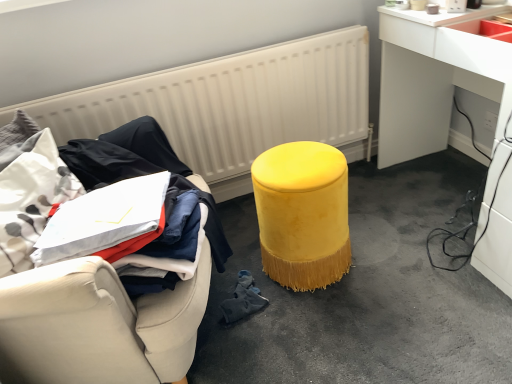
You are a GUI agent. You are given a task and a screenshot of the screen. Output one action in this format:
    pyautogui.click(x=<x>, y=<y>)
    Task: Click on the velvet yellow stool at center
    The width and height of the screenshot is (512, 384).
    Given the screenshot: What is the action you would take?
    pyautogui.click(x=303, y=214)

This screenshot has height=384, width=512. I want to click on velvet yellow stool at center, so click(366, 295).

I want to click on velvet yellow stool at center, so (x=82, y=300).

Which is behind, point (225, 122) or point (152, 139)?

The point (225, 122) is farther.

From a real-world perspective, is white textured radiator at upper center on top of black fabric at left?

No, from a real-world perspective, white textured radiator at upper center is not over black fabric at left

Is white textured radiator at upper center wider than black fabric at left?

No.

From the image's perspective, is white textured radiator at upper center above or below black fabric at left?

Clearly, from the image's perspective, white textured radiator at upper center is above black fabric at left.

From a real-world perspective, is white glossy desk at right above or below velvet yellow stool at center?

white glossy desk at right is situated higher than velvet yellow stool at center in the real world.

How many degrees apart are the facing directions of white glossy desk at right and velvet yellow stool at center?

They differ by 89.2 degrees in their facing directions.

Is velvet yellow stool at center surrounded by white glossy desk at right?

No, velvet yellow stool at center is not surrounded by white glossy desk at right.

Which object is wider, white glossy desk at right or velvet yellow stool at center?

white glossy desk at right.

Choose the correct answer: Is white textured radiator at upper center inside velvet yellow stool at center or outside it?

white textured radiator at upper center is outside velvet yellow stool at center.

Is white textured radiator at upper center facing towards velvet yellow stool at center?

Yes, white textured radiator at upper center is facing velvet yellow stool at center.

Looking at the image, does white textured radiator at upper center seem bigger or smaller compared to velvet yellow stool at center?

In the image, white textured radiator at upper center appears to be larger than velvet yellow stool at center.

How different are the orientations of white textured radiator at upper center and velvet yellow stool at center in degrees?

The facing directions of white textured radiator at upper center and velvet yellow stool at center are 1.83 degrees apart.

Is white textured radiator at upper center to the left or to the right of white glossy desk at right in the image?

Clearly, white textured radiator at upper center is on the left of white glossy desk at right in the image.

How different are the orientations of white textured radiator at upper center and white glossy desk at right in degrees?

white textured radiator at upper center and white glossy desk at right are facing 91.1 degrees away from each other.

In the scene shown: Is white textured radiator at upper center positioned in front of white glossy desk at right?

No, white textured radiator at upper center is further to the viewer.

You are a GUI agent. You are given a task and a screenshot of the screen. Output one action in this format:
    pyautogui.click(x=<x>, y=<y>)
    Task: Click on the radiator located on the left of white glossy desk at right
    
    Given the screenshot: What is the action you would take?
    pyautogui.click(x=230, y=102)

From the image's perspective, would you say white textured radiator at upper center is positioned over velvet yellow stool at center?

Indeed, from the image's perspective, white textured radiator at upper center is shown above velvet yellow stool at center.

Can you confirm if white textured radiator at upper center is wider than velvet yellow stool at center?

No.

You are a GUI agent. You are given a task and a screenshot of the screen. Output one action in this format:
    pyautogui.click(x=<x>, y=<y>)
    Task: Click on the radiator above the velvet yellow stool at center (from a real-world perspective)
    
    Given the screenshot: What is the action you would take?
    pyautogui.click(x=230, y=102)

Which object is closer to the camera, white textured radiator at upper center or velvet yellow stool at center?

velvet yellow stool at center.

Is there a large distance between black fabric at left and white textured radiator at upper center?

They are positioned close to each other.

Is black fabric at left behind white textured radiator at upper center?

No, black fabric at left is in front of white textured radiator at upper center.

In order to click on clothing below the white textured radiator at upper center (from the image's perspective) in this screenshot , I will do `click(147, 144)`.

Which of these two, black fabric at left or white textured radiator at upper center, is wider?

Wider between the two is black fabric at left.

Who is more distant, velvet yellow stool at center or velvet yellow stool at center?

velvet yellow stool at center is behind.

From the image's perspective, which object appears higher, velvet yellow stool at center or velvet yellow stool at center?

velvet yellow stool at center appears higher in the image.

Is velvet yellow stool at center placed right next to velvet yellow stool at center?

No, velvet yellow stool at center is not in contact with velvet yellow stool at center.

Consider the image. Does velvet yellow stool at center have a larger size compared to velvet yellow stool at center?

No, velvet yellow stool at center is not bigger than velvet yellow stool at center.

The image size is (512, 384). What are the coordinates of `radiator lying above the black fabric at left (from the image's perspective)` in the screenshot? It's located at (230, 102).

Where is `stool on the left of white glossy desk at right`? This screenshot has height=384, width=512. stool on the left of white glossy desk at right is located at coordinates (303, 214).

Which object lies nearer to the anchor point white glossy desk at right, velvet yellow stool at center or velvet yellow stool at center?

velvet yellow stool at center.

From the picture: From the image, which object appears to be nearer to white glossy desk at right, white textured radiator at upper center or velvet yellow stool at center?

white textured radiator at upper center lies closer to white glossy desk at right than the other object.

When comparing their distances from white glossy desk at right, does velvet yellow stool at center or velvet yellow stool at center seem further?

velvet yellow stool at center is positioned further to the anchor white glossy desk at right.

When comparing their distances from black fabric at left, does white textured radiator at upper center or velvet yellow stool at center seem closer?

velvet yellow stool at center is closer to black fabric at left.

Consider the image. Considering their positions, is white textured radiator at upper center positioned further to black fabric at left than white glossy desk at right?

white glossy desk at right is further to black fabric at left.

Estimate the real-world distances between objects in this image. Which object is closer to white glossy desk at right, velvet yellow stool at center or velvet yellow stool at center?

velvet yellow stool at center is closer to white glossy desk at right.

From the image, which object appears to be farther from velvet yellow stool at center, velvet yellow stool at center or black fabric at left?

Among the two, velvet yellow stool at center is located further to velvet yellow stool at center.

Based on their spatial positions, is white glossy desk at right or white textured radiator at upper center further from velvet yellow stool at center?

white textured radiator at upper center is positioned further to the anchor velvet yellow stool at center.

You are a GUI agent. You are given a task and a screenshot of the screen. Output one action in this format:
    pyautogui.click(x=<x>, y=<y>)
    Task: Click on the stool situated between white textured radiator at upper center and velvet yellow stool at center from left to right
    Image resolution: width=512 pixels, height=384 pixels.
    Given the screenshot: What is the action you would take?
    pyautogui.click(x=303, y=214)

Locate an element on the screen. Image resolution: width=512 pixels, height=384 pixels. radiator between velvet yellow stool at center and white glossy desk at right in the horizontal direction is located at coordinates [x=230, y=102].

The width and height of the screenshot is (512, 384). Identify the location of stool between velvet yellow stool at center and black fabric at left along the z-axis. (303, 214).

Locate an element on the screen. stool between velvet yellow stool at center and white glossy desk at right from left to right is located at coordinates (303, 214).